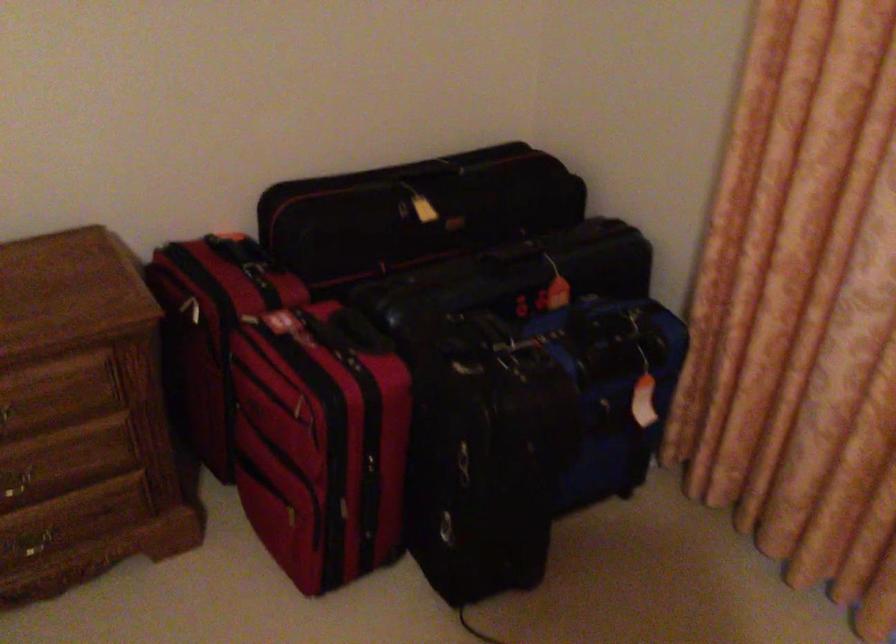
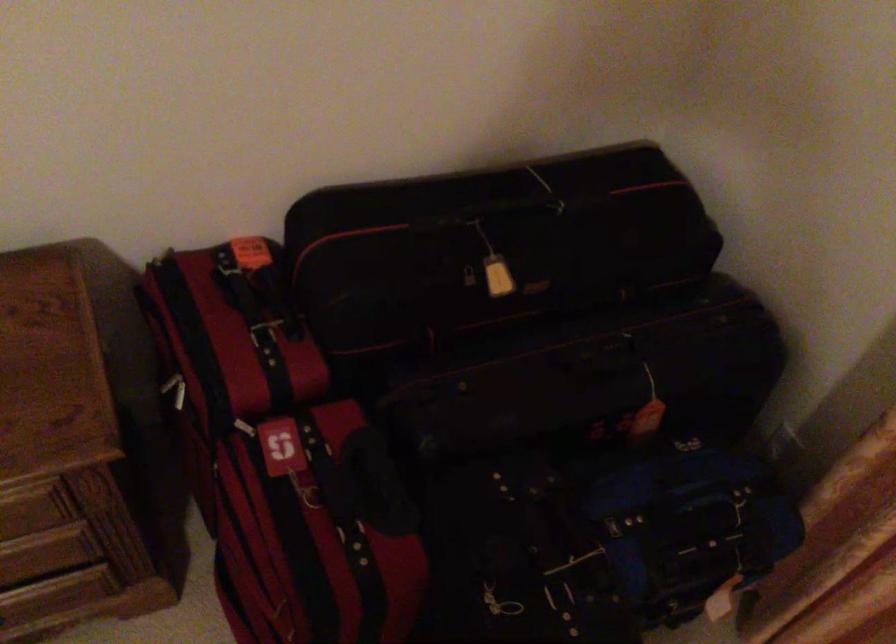
Where in the second image is the point corresponding to point (502, 345) from the first image?

(556, 552)